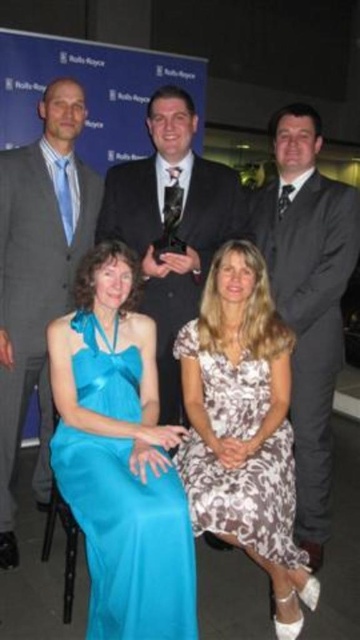
You are a photographer at the event and need to adjust the lighting to ensure both the satin blue dress at lower left and the shiny black suit at center are well lit. Given their sizes, which one might require more focused lighting to avoid being overshadowed?

The satin blue dress at lower left occupies less space than the shiny black suit at center, so it might require more focused lighting to ensure it isn not overshadowed by the larger suit.

You are a photographer at the event and need to adjust the seating arrangement to ensure all participants are visible. The gray suit at left and dark gray suit at center are currently seated next to each other. Which of these two suits is wider, and how does this affect their seating positions?

The gray suit at left is wider than the dark gray suit at center. This means the gray suit at left requires more space to ensure the wearer is fully visible in the photo, so they should be positioned where there is more room or adjusted so their width doesn